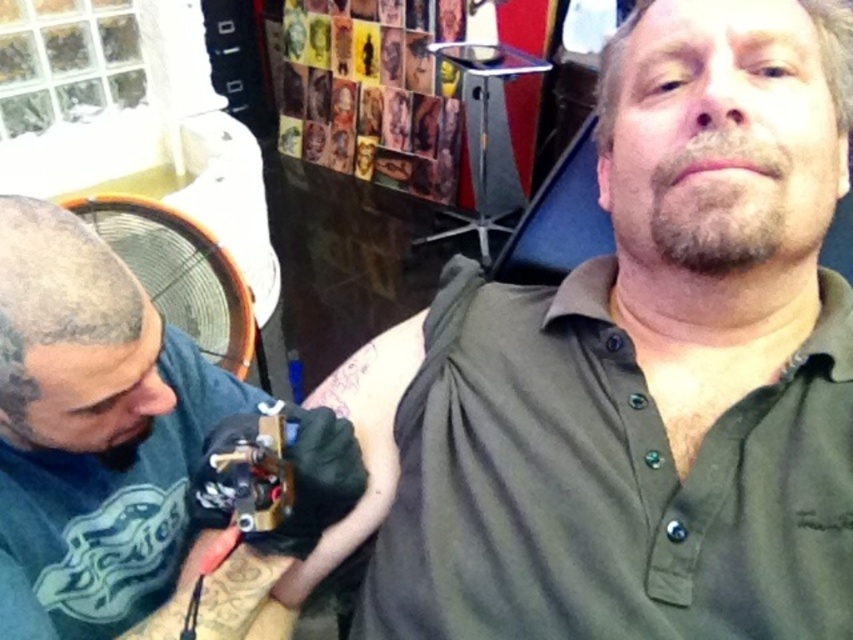
You are a customer in a tattoo parlor. You notice the green matte shirt at upper right and the black matte tattoo gun at left. Which object is positioned higher in the image?

The green matte shirt at upper right is located above the black matte tattoo gun at left, so it is positioned higher in the image.

You are a customer in a tattoo parlor. You see the green matte shirt at upper right and the black matte tattoo gun at left. Which object is positioned more to the right side of the scene?

The green matte shirt at upper right is positioned more to the right side of the scene than the black matte tattoo gun at left.